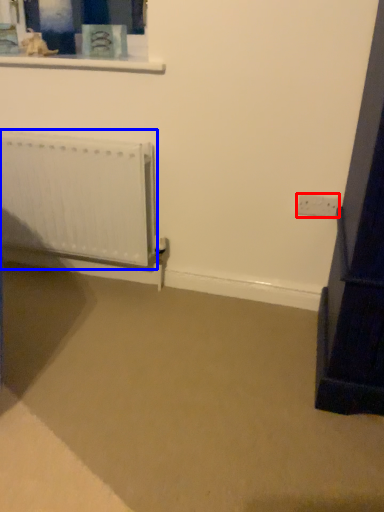
Question: Which object appears closest to the camera in this image, electric outlet (highlighted by a red box) or radiator (highlighted by a blue box)?

Choices:
 (A) electric outlet
 (B) radiator

Answer: (B)